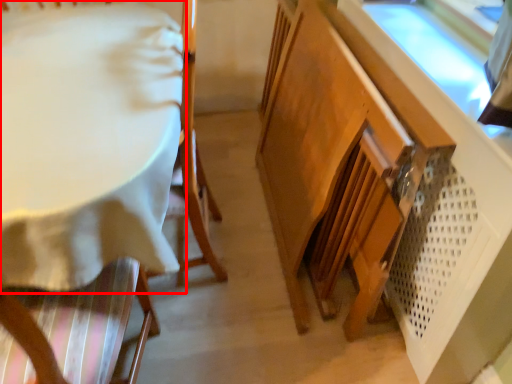
Question: In this image, where is table (annotated by the red box) located relative to cabinetry?

Choices:
 (A) right
 (B) left

Answer: (B)